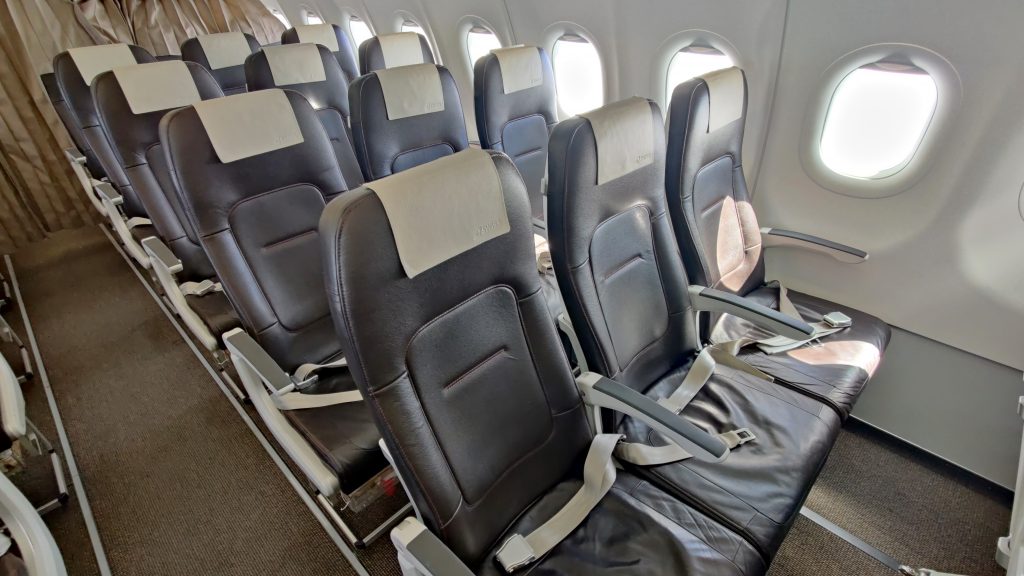
Identify the location of windows. Image resolution: width=1024 pixels, height=576 pixels. (891, 138), (1022, 200), (690, 64), (563, 68), (480, 45), (413, 28), (359, 29), (313, 21), (281, 16).